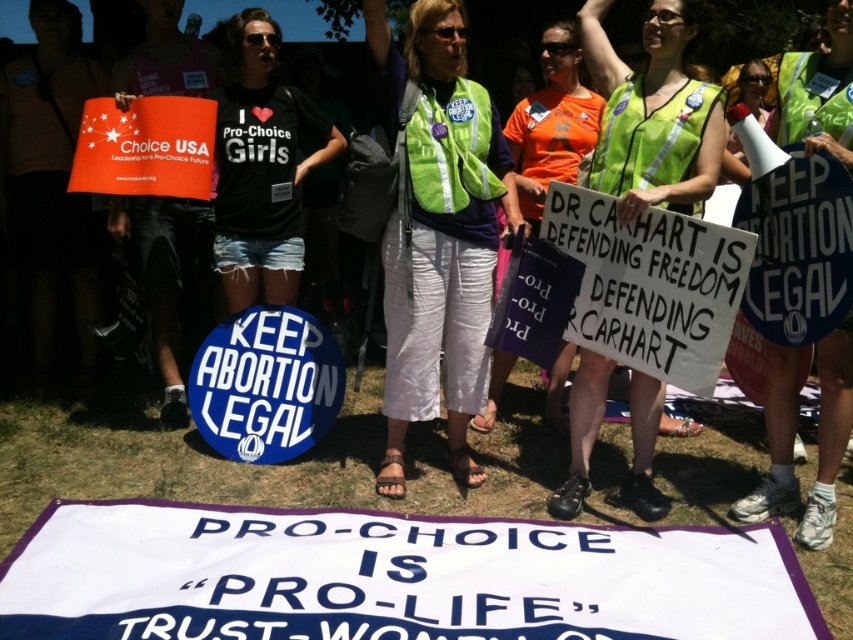
Is point (462, 401) positioned in front of point (577, 369)?

Yes, point (462, 401) is in front of point (577, 369).

Locate an element on the screen. This screenshot has height=640, width=853. green reflective vest at center is located at coordinates (439, 234).